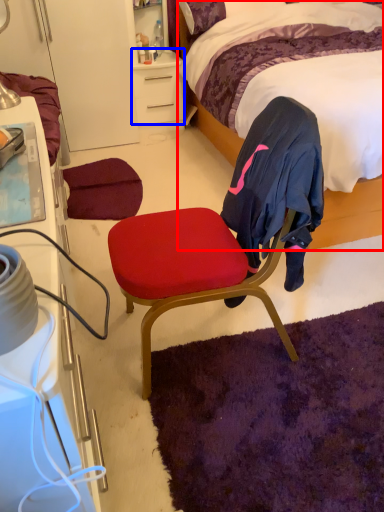
Question: Among these objects, which one is nearest to the camera, bed (highlighted by a red box) or desk (highlighted by a blue box)?

Choices:
 (A) bed
 (B) desk

Answer: (A)